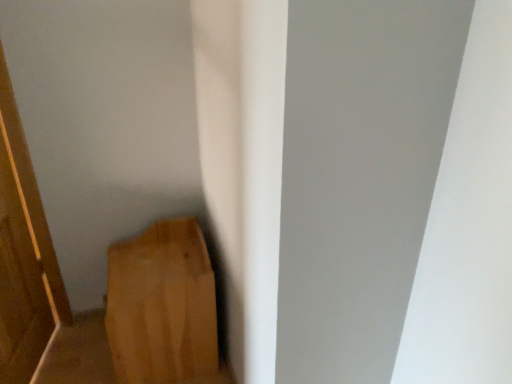
Question: From a real-world perspective, is wooden door at left physically located above or below wooden plank at lower left?

Choices:
 (A) above
 (B) below

Answer: (A)

Question: From the image's perspective, is wooden door at left located above or below wooden plank at lower left?

Choices:
 (A) below
 (B) above

Answer: (B)

Question: Is wooden door at left taller or shorter than wooden plank at lower left?

Choices:
 (A) tall
 (B) short

Answer: (A)

Question: From the image's perspective, is wooden plank at lower left located above or below wooden door at left?

Choices:
 (A) below
 (B) above

Answer: (A)

Question: From a real-world perspective, relative to wooden door at left, is wooden plank at lower left vertically above or below?

Choices:
 (A) above
 (B) below

Answer: (B)

Question: Is point (121, 336) positioned closer to the camera than point (24, 286)?

Choices:
 (A) farther
 (B) closer

Answer: (B)

Question: Is wooden plank at lower left wider or thinner than wooden door at left?

Choices:
 (A) thin
 (B) wide

Answer: (B)